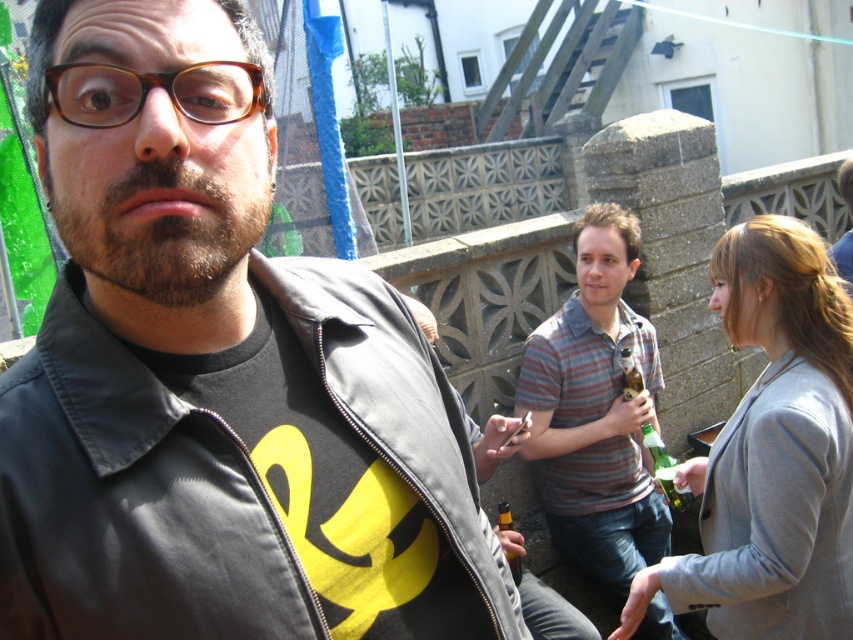
Is matte black jacket at center thinner than gray fabric jacket at right?

Incorrect, matte black jacket at center's width is not less than gray fabric jacket at right's.

Is matte black jacket at center wider than gray fabric jacket at right?

Yes.

You are a GUI agent. You are given a task and a screenshot of the screen. Output one action in this format:
    pyautogui.click(x=<x>, y=<y>)
    Task: Click on the matte black jacket at center
    The height and width of the screenshot is (640, 853).
    Given the screenshot: What is the action you would take?
    pyautogui.click(x=223, y=394)

Find the location of a particular element. matte black jacket at center is located at coordinates (223, 394).

Consider the image. Is gray fabric jacket at right positioned at the back of translucent glass bottle at center?

No, gray fabric jacket at right is closer to the viewer.

Is gray fabric jacket at right to the right of translucent glass bottle at center from the viewer's perspective?

Indeed, gray fabric jacket at right is positioned on the right side of translucent glass bottle at center.

What are the coordinates of `gray fabric jacket at right` in the screenshot? It's located at (772, 451).

The height and width of the screenshot is (640, 853). Find the location of `gray fabric jacket at right`. gray fabric jacket at right is located at coordinates (772, 451).

Which is above, matte black jacket at center or striped cotton shirt at center?

Positioned higher is matte black jacket at center.

Can you confirm if matte black jacket at center is shorter than striped cotton shirt at center?

Indeed, matte black jacket at center has a lesser height compared to striped cotton shirt at center.

Does point (309, 292) come farther from viewer compared to point (669, 547)?

No, (309, 292) is in front of (669, 547).

Locate an element on the screen. This screenshot has width=853, height=640. matte black jacket at center is located at coordinates (223, 394).